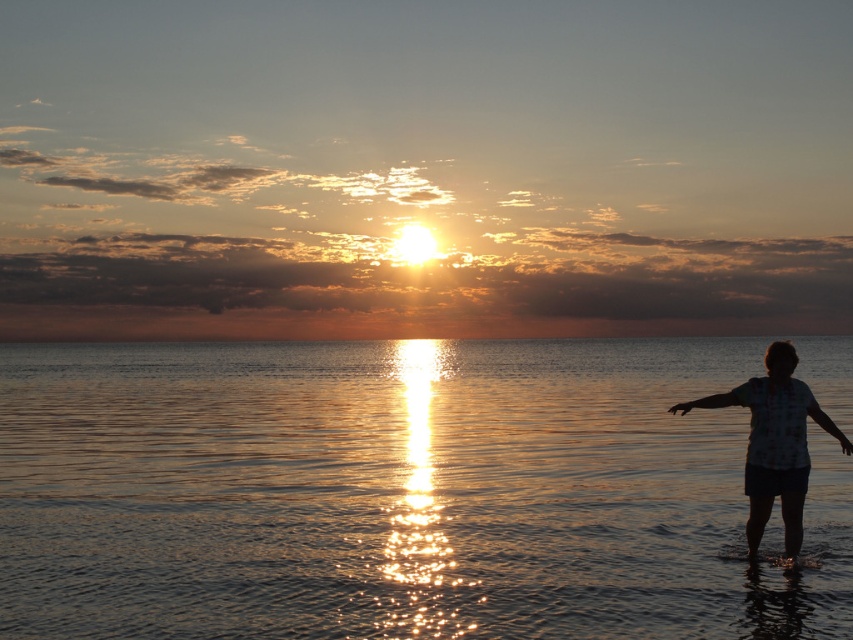
Can you confirm if glistening water at center is positioned above silhouette fabric at right?

No.

I want to click on glistening water at center, so 398,493.